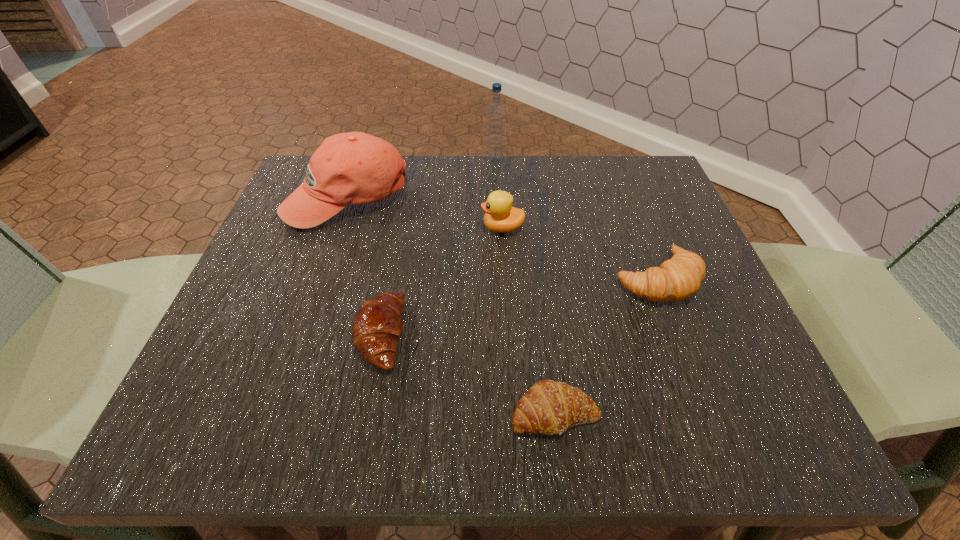
In order to click on vacant space located 0.400m on the front of the fifth shortest object in this screenshot , I will do `click(270, 422)`.

The image size is (960, 540). Find the location of `vacant point located on the face of the duckling`. vacant point located on the face of the duckling is located at coordinates (377, 228).

Identify the location of blank space located on the face of the duckling. This screenshot has width=960, height=540. (343, 228).

The width and height of the screenshot is (960, 540). What are the coordinates of `blank area located 0.240m on the face of the duckling` in the screenshot? It's located at (363, 228).

Find the location of `vacant area situated 0.200m on the front of the rightmost crescent roll`. vacant area situated 0.200m on the front of the rightmost crescent roll is located at coordinates (710, 420).

Where is `free space located on the right of the leftmost crescent roll`? The width and height of the screenshot is (960, 540). free space located on the right of the leftmost crescent roll is located at coordinates [x=478, y=335].

The height and width of the screenshot is (540, 960). I want to click on vacant point located 0.150m on the back of the second crescent roll from left to right, so click(541, 309).

Locate an element on the screen. This screenshot has height=540, width=960. water bottle present at the far edge is located at coordinates (496, 114).

This screenshot has height=540, width=960. What are the coordinates of `baseball cap present at the far edge` in the screenshot? It's located at (348, 168).

Locate an element on the screen. The width and height of the screenshot is (960, 540). object at the near edge is located at coordinates (548, 407).